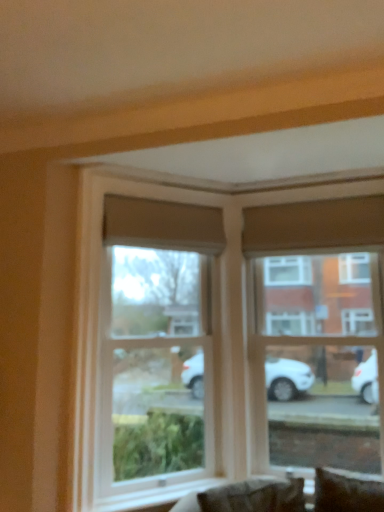
Question: Is clear glass window at upper right, the first window viewed from the right, taller or shorter than dark brown leather couch at lower center?

Choices:
 (A) tall
 (B) short

Answer: (A)

Question: Choose the correct answer: Is clear glass window at upper right, the 2th window in the left-to-right sequence, inside dark brown leather couch at lower center or outside it?

Choices:
 (A) inside
 (B) outside

Answer: (B)

Question: Which is farther from the clear glass window at upper right, the first window viewed from the right?

Choices:
 (A) dark brown leather couch at lower center
 (B) clear glass window at center, the 1th window in the left-to-right sequence

Answer: (A)

Question: Considering the real-world distances, which object is farthest from the clear glass window at upper right, the 2th window in the left-to-right sequence?

Choices:
 (A) dark brown leather couch at lower center
 (B) clear glass window at center, the 1th window in the left-to-right sequence

Answer: (A)